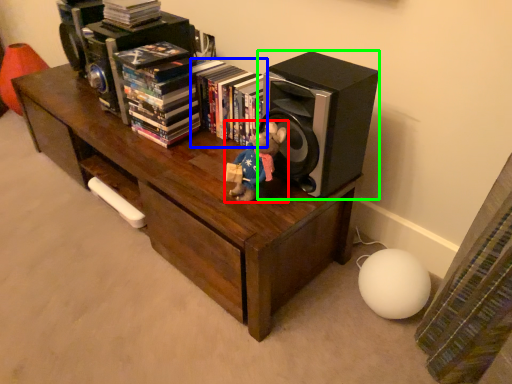
Question: Which is nearer to the toy (highlighted by a red box)? book (highlighted by a blue box) or speaker (highlighted by a green box).

Choices:
 (A) book
 (B) speaker

Answer: (B)